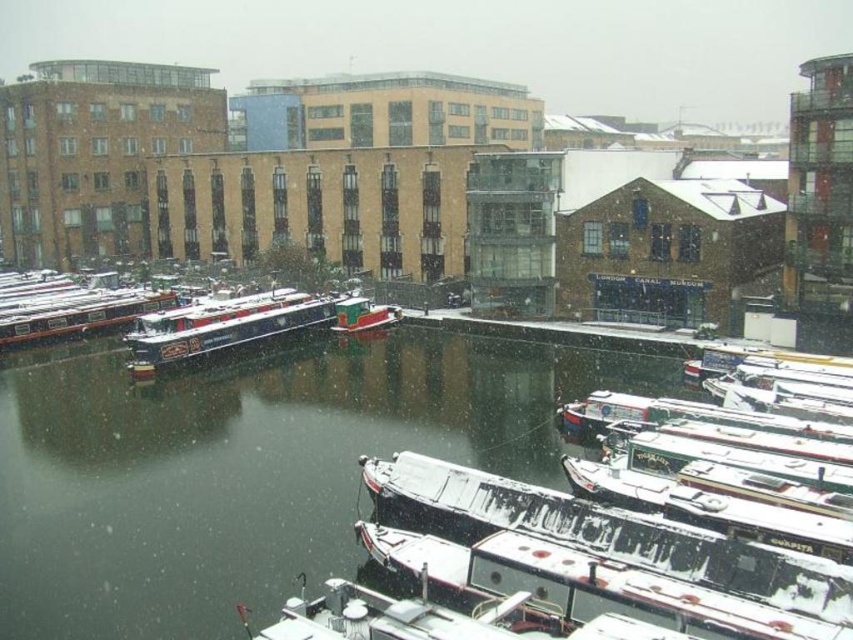
Is blue polished wood boat at center-left bigger than green matte canal boat at left?

Yes, blue polished wood boat at center-left is bigger than green matte canal boat at left.

From the picture: Is blue polished wood boat at center-left shorter than green matte canal boat at left?

No.

This screenshot has width=853, height=640. What are the coordinates of `blue polished wood boat at center-left` in the screenshot? It's located at click(x=221, y=326).

Is point (154, 308) behind point (340, 307)?

Yes.

Consider the image. Measure the distance from green matte canal boat at left to green matte boat at center.

The distance of green matte canal boat at left from green matte boat at center is 24.16 meters.

Is point (136, 296) farther from viewer compared to point (376, 310)?

Yes, point (136, 296) is behind point (376, 310).

What are the coordinates of `green matte canal boat at left` in the screenshot? It's located at (76, 312).

Is white glossy boat at lower center positioned before green matte boat at center?

Yes, it is.

Which is more to the left, white glossy boat at lower center or green matte boat at center?

From the viewer's perspective, green matte boat at center appears more on the left side.

Which is in front, point (491, 609) or point (347, 305)?

Point (491, 609) is more forward.

This screenshot has width=853, height=640. I want to click on white glossy boat at lower center, so click(389, 618).